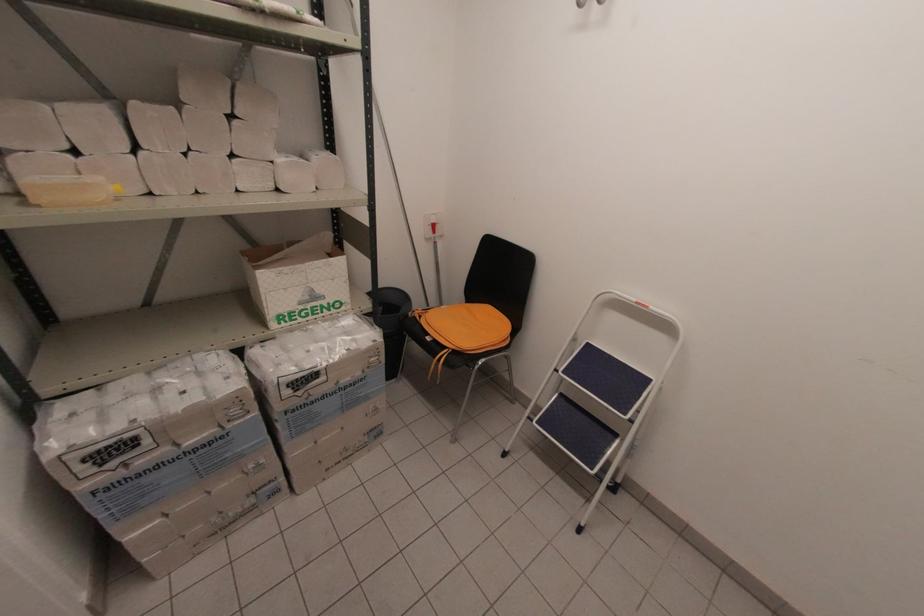
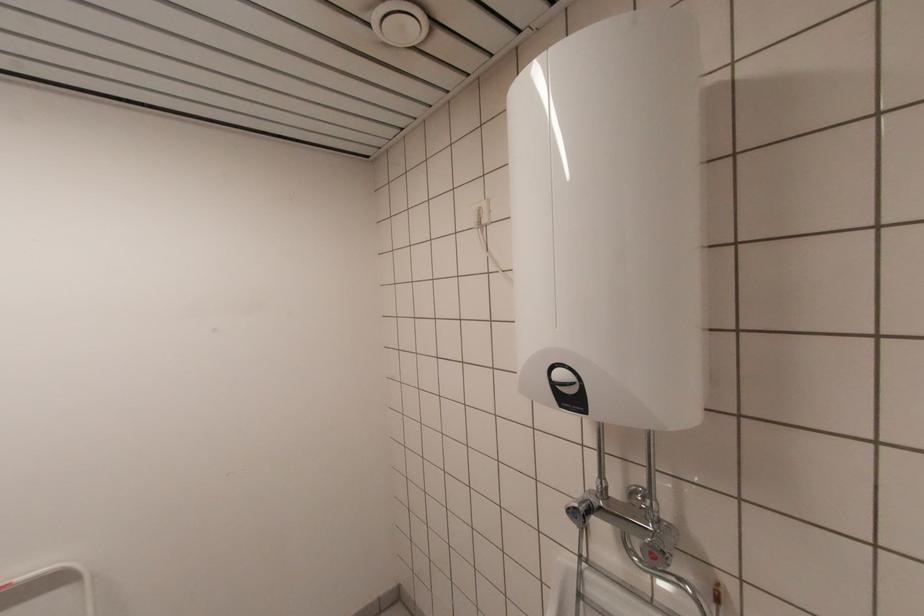
Question: How did the camera likely rotate?

Choices:
 (A) Left
 (B) Right
 (C) Up
 (D) Down

Answer: (B)